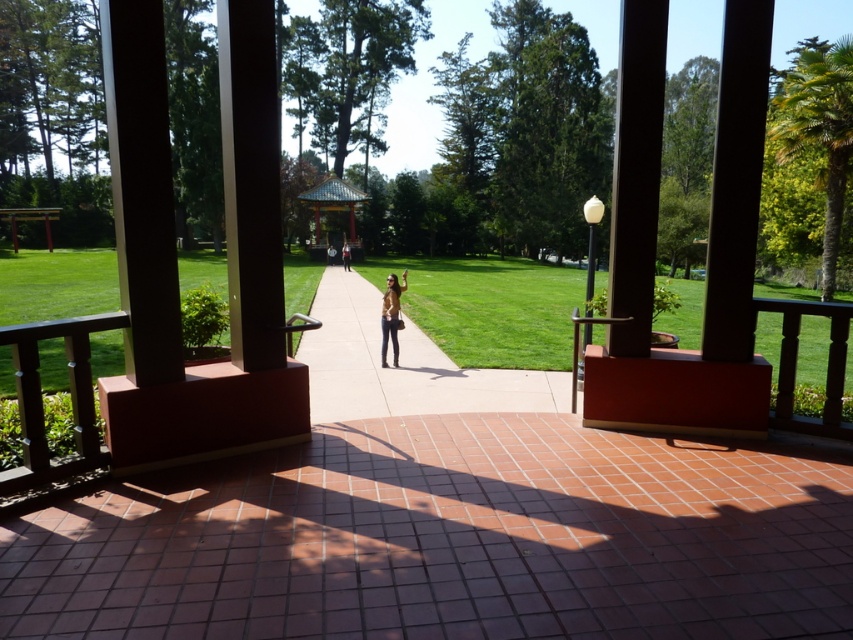
Question: Can you confirm if smooth concrete sidewalk at center is positioned to the right of matte brown jacket at center?

Choices:
 (A) no
 (B) yes

Answer: (B)

Question: Which point is closer to the camera taking this photo?

Choices:
 (A) (344, 262)
 (B) (457, 392)
 (C) (393, 356)
 (D) (352, 195)

Answer: (B)

Question: Estimate the real-world distances between objects in this image. Which object is closer to the smooth concrete sidewalk at center?

Choices:
 (A) leather jacket at center
 (B) multicolored tiled gazebo at center
 (C) matte brown jacket at center

Answer: (A)

Question: Which of the following is the farthest from the observer?

Choices:
 (A) (341, 257)
 (B) (402, 276)
 (C) (315, 218)
 (D) (352, 410)

Answer: (C)

Question: Does leather jacket at center have a larger size compared to matte brown jacket at center?

Choices:
 (A) no
 (B) yes

Answer: (A)

Question: Is smooth concrete sidewalk at center further to the viewer compared to matte brown jacket at center?

Choices:
 (A) yes
 (B) no

Answer: (B)